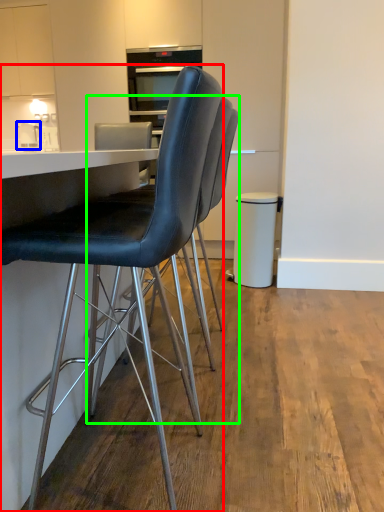
Question: Which is nearer to the chair (highlighted by a red box)? appliance (highlighted by a blue box) or chair (highlighted by a green box).

Choices:
 (A) appliance
 (B) chair

Answer: (B)